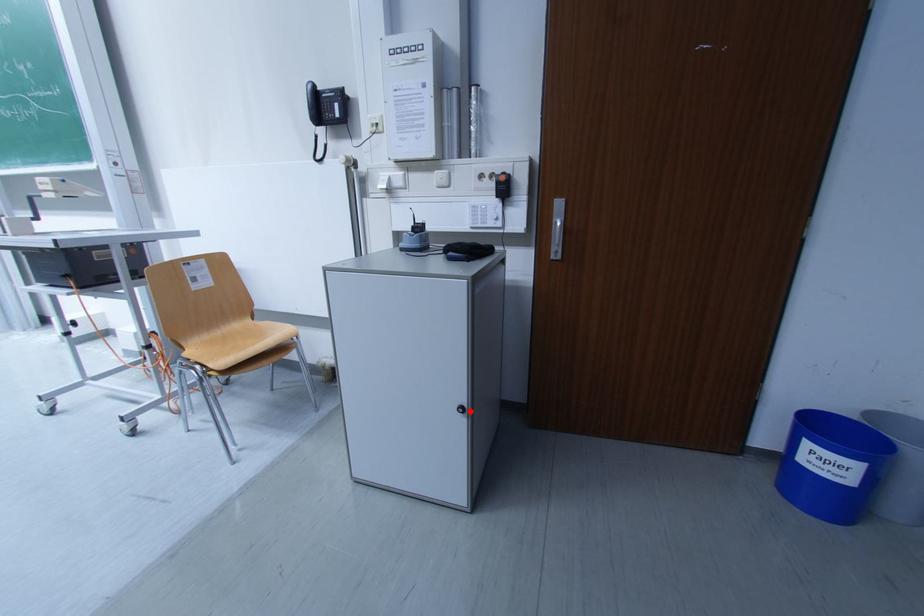
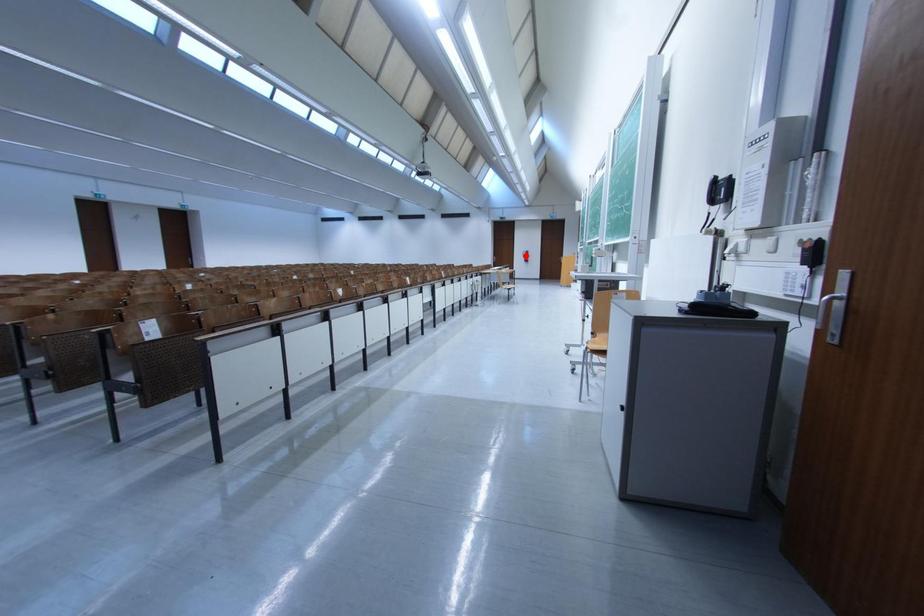
I am providing you with two images of the same scene from different viewpoints. A red point is marked on the first image and another point is marked on the second image. Does the point marked in image1 correspond to the same location as the one in image2?

No